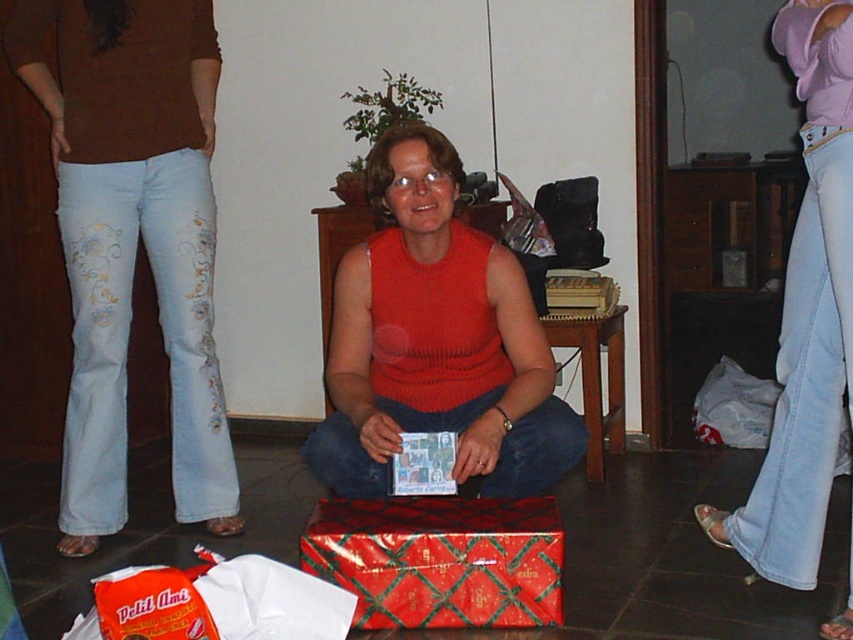
Based on the photo, you are a photographer trying to capture a shot of the light blue denim jeans at left and the light purple fabric at upper right. Which object is positioned more to the left side of the image?

The light blue denim jeans at left is positioned more to the left side of the image than the light purple fabric at upper right.

In the scene shown: You are a tailor measuring fabrics for a project. You have a light blue denim jeans at left and a light purple fabric at upper right. Which fabric has a larger area?

The light purple fabric at upper right has a larger area than the light blue denim jeans at left.

You are organizing a clothing display and need to know which item is wider between the light blue denim jeans at left and the light purple fabric at upper right. Which one should you choose for a wider display space?

The light blue denim jeans at left is wider than the light purple fabric at upper right, so you should choose the light blue denim jeans at left for a wider display space.